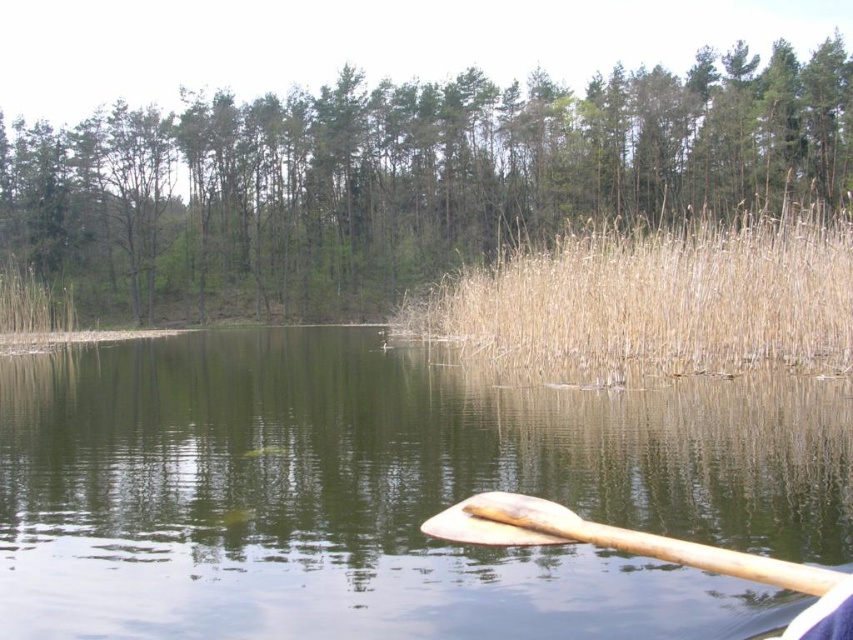
Is wooden paddle at lower right below brown dry reed at left?

Yes, wooden paddle at lower right is below brown dry reed at left.

Is point (817, 570) positioned behind point (44, 301)?

No, it is not.

The width and height of the screenshot is (853, 640). In order to click on wooden paddle at lower right in this screenshot , I will do `click(608, 540)`.

The width and height of the screenshot is (853, 640). What do you see at coordinates (389, 493) in the screenshot? I see `greenish water at lower center` at bounding box center [389, 493].

Does greenish water at lower center lie in front of green matte tree at upper center?

Yes.

Between point (155, 627) and point (366, 202), which one is positioned in front?

Point (155, 627) is more forward.

You are a GUI agent. You are given a task and a screenshot of the screen. Output one action in this format:
    pyautogui.click(x=<x>, y=<y>)
    Task: Click on the greenish water at lower center
    
    Given the screenshot: What is the action you would take?
    pyautogui.click(x=389, y=493)

Who is positioned more to the left, green matte tree at upper center or brown dry reed at left?

Positioned to the left is brown dry reed at left.

Between green matte tree at upper center and brown dry reed at left, which one is positioned higher?

green matte tree at upper center is above.

This screenshot has height=640, width=853. What are the coordinates of `green matte tree at upper center` in the screenshot? It's located at (405, 179).